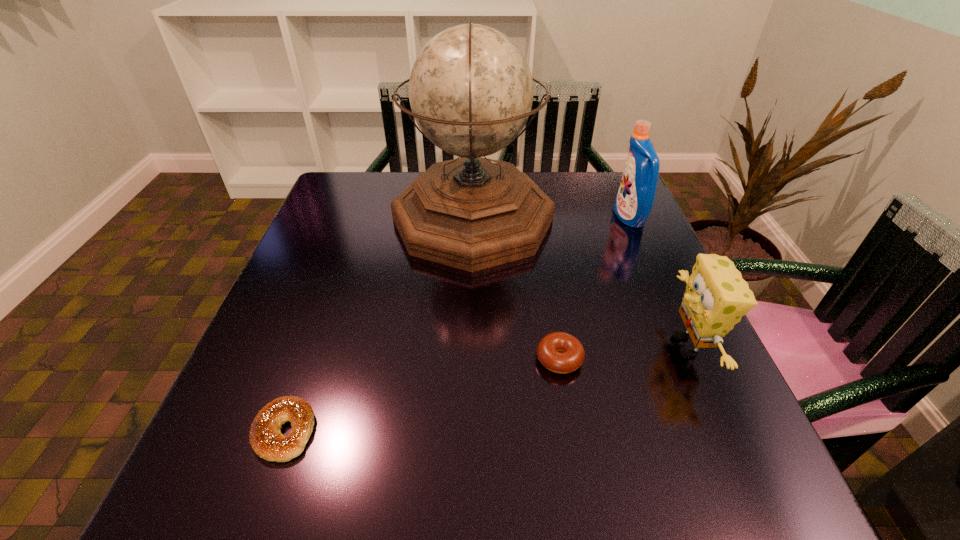
I want to click on the tallest object, so click(x=471, y=90).

At what (x,y) coordinates should I click in order to perform the action: click on detergent. Please return your answer as a coordinate pair (x, y). This screenshot has width=960, height=540. Looking at the image, I should click on (635, 198).

In order to click on the third shortest object in this screenshot , I will do `click(716, 297)`.

This screenshot has width=960, height=540. I want to click on doughnut, so click(x=549, y=349).

Identify the location of the leftmost object. Image resolution: width=960 pixels, height=540 pixels. (267, 441).

The image size is (960, 540). I want to click on the nearest object, so click(267, 441).

Locate an element on the screen. The image size is (960, 540). free space located 0.220m on the surface of the tallest object is located at coordinates (638, 219).

Image resolution: width=960 pixels, height=540 pixels. I want to click on vacant space located on the label of the fourth shortest object, so click(500, 218).

Identify the location of blank space located on the label of the fourth shortest object. (596, 218).

At what (x,y) coordinates should I click in order to perform the action: click on vacant space located 0.050m on the label of the fourth shortest object. Please return your answer as a coordinate pair (x, y). The width and height of the screenshot is (960, 540). Looking at the image, I should click on pyautogui.click(x=596, y=218).